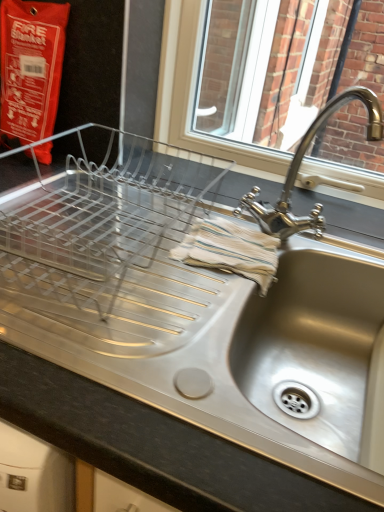
Question: Considering the relative sizes of polished chrome faucet at upper right and stainless steel sink at lower right in the image provided, is polished chrome faucet at upper right taller than stainless steel sink at lower right?

Choices:
 (A) no
 (B) yes

Answer: (B)

Question: Is the depth of polished chrome faucet at upper right less than that of stainless steel sink at lower right?

Choices:
 (A) no
 (B) yes

Answer: (A)

Question: Is stainless steel sink at lower right located within polished chrome faucet at upper right?

Choices:
 (A) yes
 (B) no

Answer: (B)

Question: From the image's perspective, does polished chrome faucet at upper right appear higher than stainless steel sink at lower right?

Choices:
 (A) yes
 (B) no

Answer: (A)

Question: Are polished chrome faucet at upper right and stainless steel sink at lower right far apart?

Choices:
 (A) no
 (B) yes

Answer: (A)

Question: Is polished chrome faucet at upper right at the right side of stainless steel sink at lower right?

Choices:
 (A) no
 (B) yes

Answer: (A)

Question: Does satin steel sink at center appear on the left side of stainless steel sink at lower right?

Choices:
 (A) yes
 (B) no

Answer: (A)

Question: Is satin steel sink at center far from stainless steel sink at lower right?

Choices:
 (A) no
 (B) yes

Answer: (A)

Question: Is satin steel sink at center shorter than stainless steel sink at lower right?

Choices:
 (A) no
 (B) yes

Answer: (A)

Question: Is satin steel sink at center thinner than stainless steel sink at lower right?

Choices:
 (A) no
 (B) yes

Answer: (A)

Question: Can you confirm if satin steel sink at center is wider than stainless steel sink at lower right?

Choices:
 (A) yes
 (B) no

Answer: (A)

Question: Is satin steel sink at center further to camera compared to stainless steel sink at lower right?

Choices:
 (A) no
 (B) yes

Answer: (A)

Question: Is polished chrome faucet at upper right not near satin steel sink at center?

Choices:
 (A) no
 (B) yes

Answer: (A)